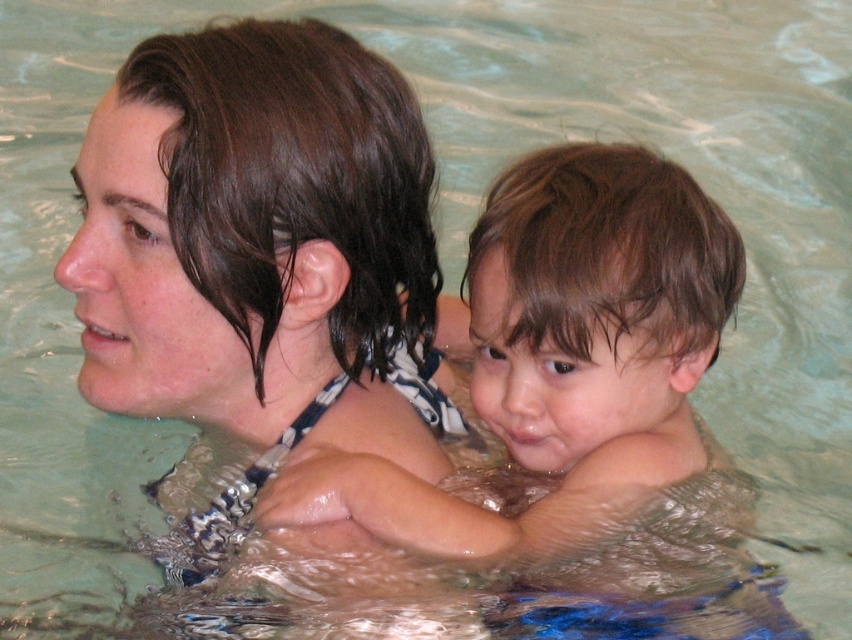
You are a lifeguard observing the pool area. You notice the wet hair at upper left and the wet skin child at center in the water. Which object is positioned higher relative to the other?

The wet hair at upper left is located above the wet skin child at center, so it is positioned higher.

You are a lifeguard observing the pool area. You notice the wet hair at upper left and the wet skin child at center. Which one is higher up in the water?

The wet hair at upper left is taller than the wet skin child at center, so the wet hair at upper left is higher up in the water.

You are a lifeguard on duty and need to ensure safety between the wet hair at upper left and the wet skin child at center. What is the minimum distance you should maintain between them for safety?

The minimum distance you should maintain between the wet hair at upper left and the wet skin child at center is 6.91 inches, as that is the current distance between them.